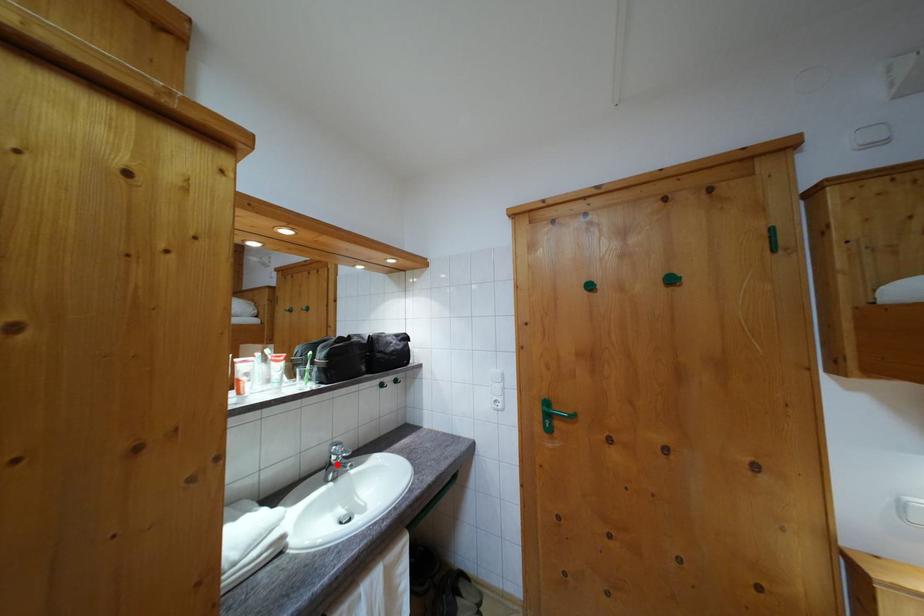
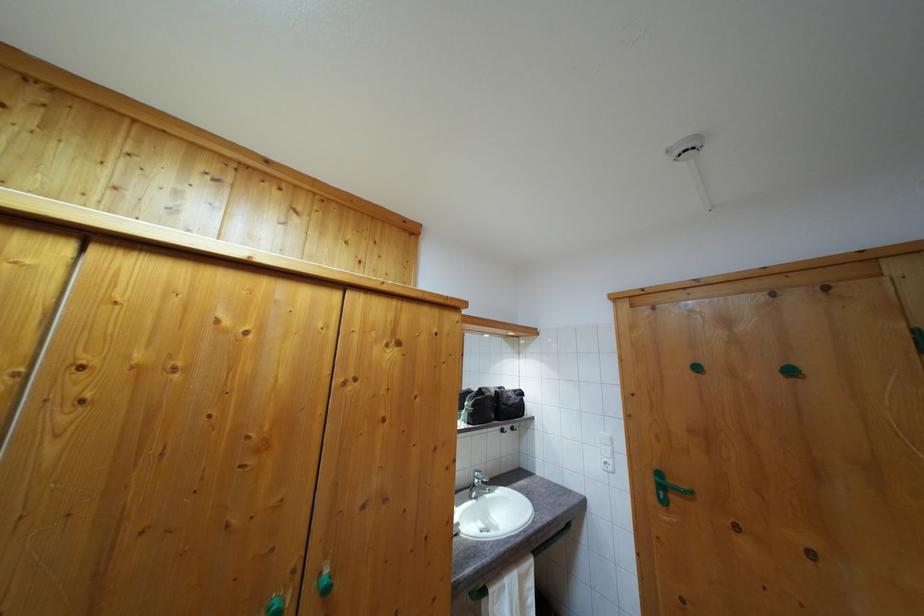
Find the pixel in the second image that matches the highlighted location in the first image.

(480, 488)